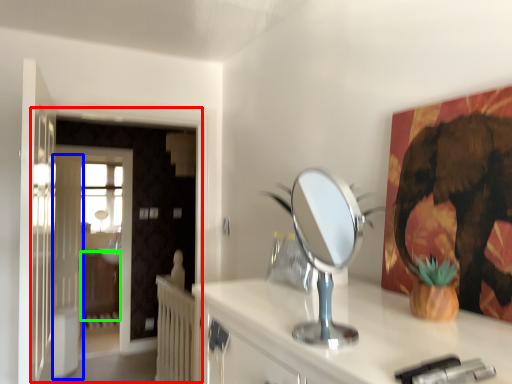
Question: Which object is the farthest from door (highlighted by a red box)? Choose among these: door (highlighted by a blue box) or dresser (highlighted by a green box).

Choices:
 (A) door
 (B) dresser

Answer: (B)